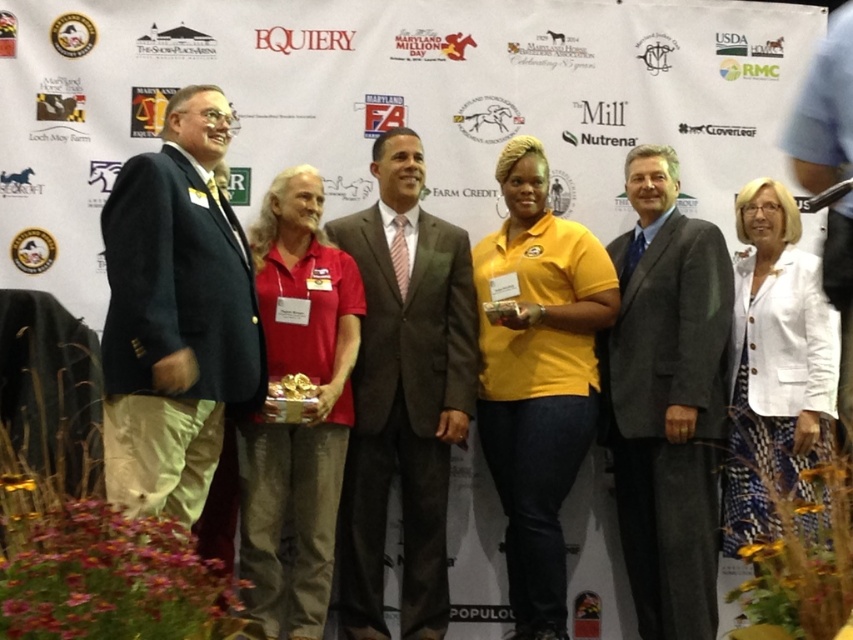
You are a photographer at the event and need to position yourself so that both point (202,141) and point (367,572) are in your camera frame. Given that you can only move forward or backward, which direction should you move to ensure both points are visible?

Since point (202,141) is in front of point (367,572), you should move backward to ensure both points are visible in your camera frame.

You are a photographer at the event and need to capture a photo of the two individuals wearing the brown textured suit at center and the gray suit at center. Which one should you focus on first if you want to start from the left side?

The brown textured suit at center is to the left of gray suit at center, so you should focus on the brown textured suit at center first.